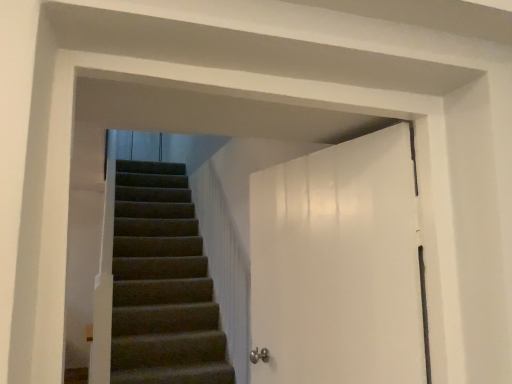
Where is `white glossy door at center`? This screenshot has height=384, width=512. white glossy door at center is located at coordinates (338, 265).

This screenshot has width=512, height=384. Describe the element at coordinates (338, 265) in the screenshot. I see `white glossy door at center` at that location.

Where is `white glossy door at center`? white glossy door at center is located at coordinates (338, 265).